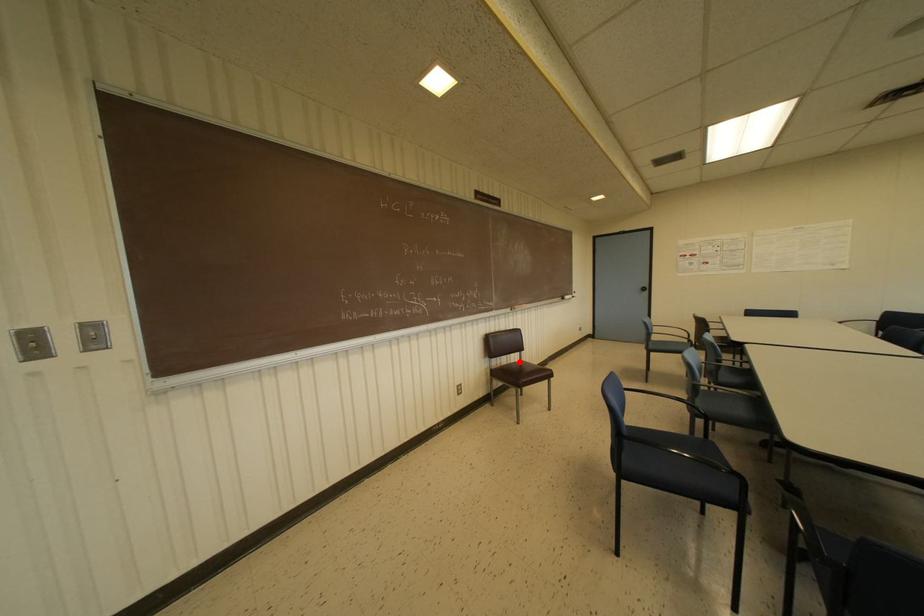
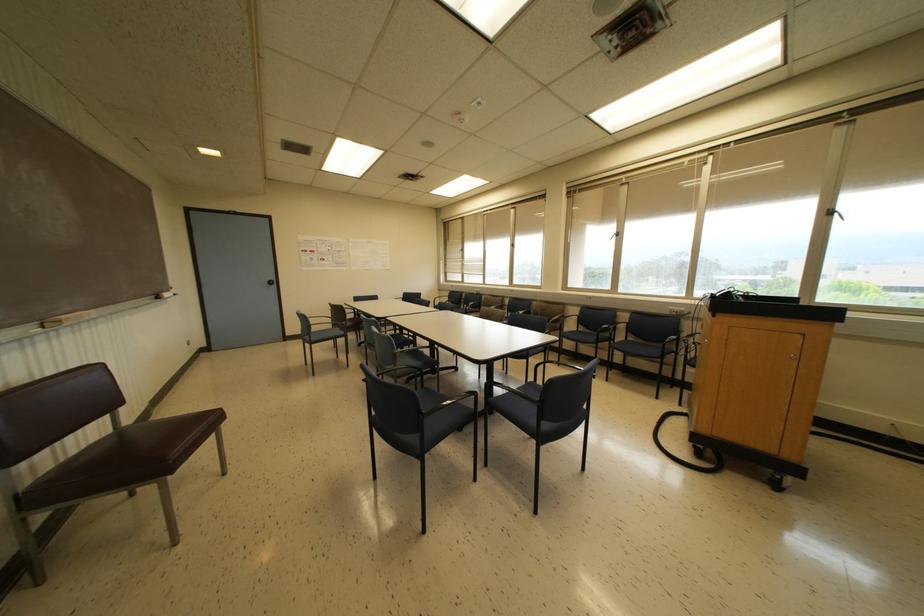
Find the pixel in the second image that matches the highlighted location in the first image.

(118, 430)